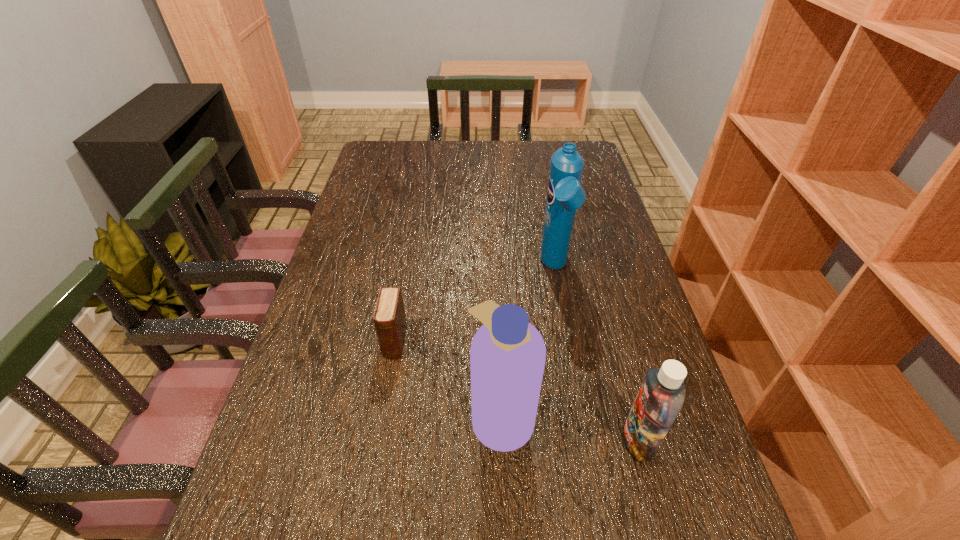
Point out which shampoo is positioned as the nearest to the second object from left to right. Please provide its 2D coordinates. Your answer should be formatted as a tuple, i.e. [(x, y)], where the tuple contains the x and y coordinates of a point satisfying the conditions above.

[(661, 396)]

Where is `vacant space that satisfies the following two spatial constraints: 1. on the spine side of the leftmost object; 2. on the left side of the second object from left to right`? Image resolution: width=960 pixels, height=540 pixels. vacant space that satisfies the following two spatial constraints: 1. on the spine side of the leftmost object; 2. on the left side of the second object from left to right is located at coordinates (382, 417).

Find the location of a particular element. Image resolution: width=960 pixels, height=540 pixels. free location that satisfies the following two spatial constraints: 1. on the spine side of the diary; 2. on the left side of the second object from left to right is located at coordinates (382, 417).